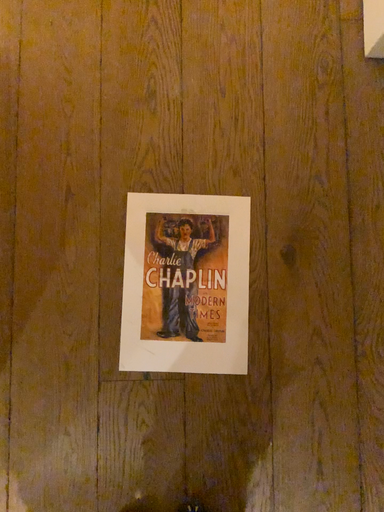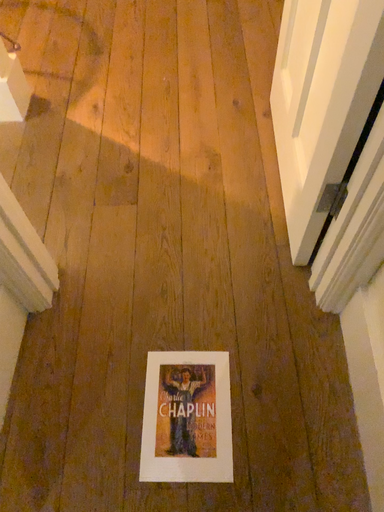
Question: How did the camera likely rotate when shooting the video?

Choices:
 (A) rotated upward
 (B) rotated downward

Answer: (A)